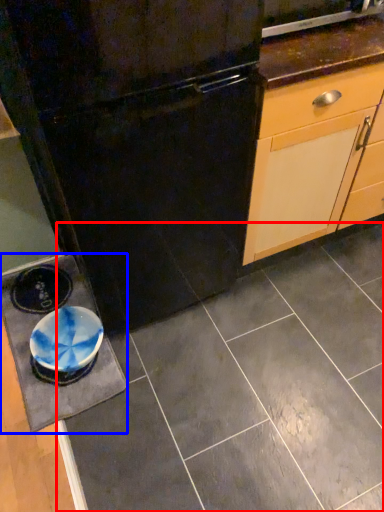
Question: Which object is further to the camera taking this photo, ceramic tile (highlighted by a red box) or slate (highlighted by a blue box)?

Choices:
 (A) ceramic tile
 (B) slate

Answer: (B)